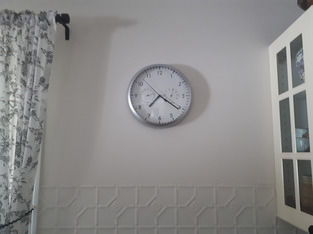
The width and height of the screenshot is (313, 234). Identify the location of clock. [x=161, y=82].